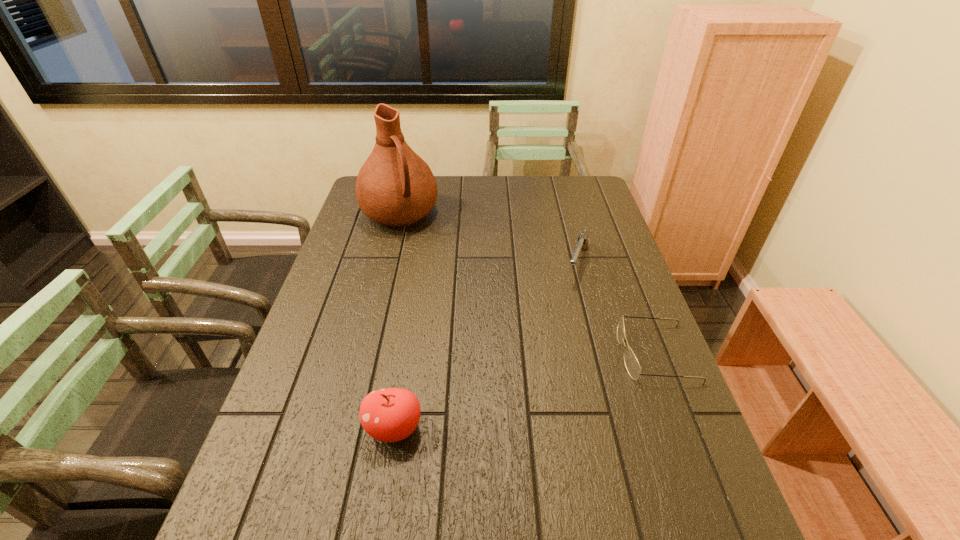
Find the location of a particular element. The height and width of the screenshot is (540, 960). spectacles at the right edge is located at coordinates (632, 365).

Identify the location of gun situated at the right edge. coord(582,243).

Where is `object that is at the far left corner`? This screenshot has width=960, height=540. object that is at the far left corner is located at coordinates (395, 187).

In the image, there is a desktop. Identify the location of free region at the far edge. (551, 192).

This screenshot has width=960, height=540. In order to click on vacant space at the near edge in this screenshot , I will do `click(623, 481)`.

You are a GUI agent. You are given a task and a screenshot of the screen. Output one action in this format:
    pyautogui.click(x=<x>, y=<y>)
    Task: Click on the blank space at the left edge
    The width and height of the screenshot is (960, 540).
    Given the screenshot: What is the action you would take?
    pyautogui.click(x=362, y=268)

Identify the location of vacant point at the right edge. (570, 237).

The image size is (960, 540). I want to click on free space that is in between the second object from right to left and the third farthest object, so click(616, 308).

Find the location of a particular element. empty space between the third farthest object and the farthest object is located at coordinates (528, 284).

At what (x,y) coordinates should I click in order to perform the action: click on vacant region between the third nearest object and the nearest object. Please return your answer as a coordinate pair (x, y). The width and height of the screenshot is (960, 540). Looking at the image, I should click on (486, 346).